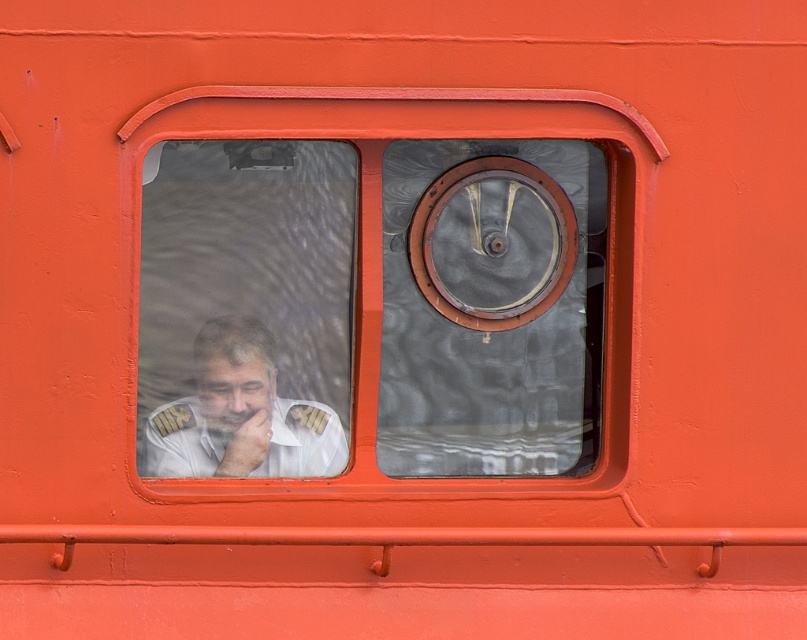
You are a photographer trying to capture the view through the transparent glass window at center and the white uniform at left. Which object is taller in the image?

The transparent glass window at center is taller than the white uniform at left according to the description.

Based on the photo, you are a photographer taking a picture of the ship. You notice two points marked on the ship. The first point is at coordinate point (266,353) and the second is at point (307,460). Which point will appear closer to you in the photo?

Point (266,353) is further to the camera than point (307,460), so in the photo, point (266,353) will appear closer to you.